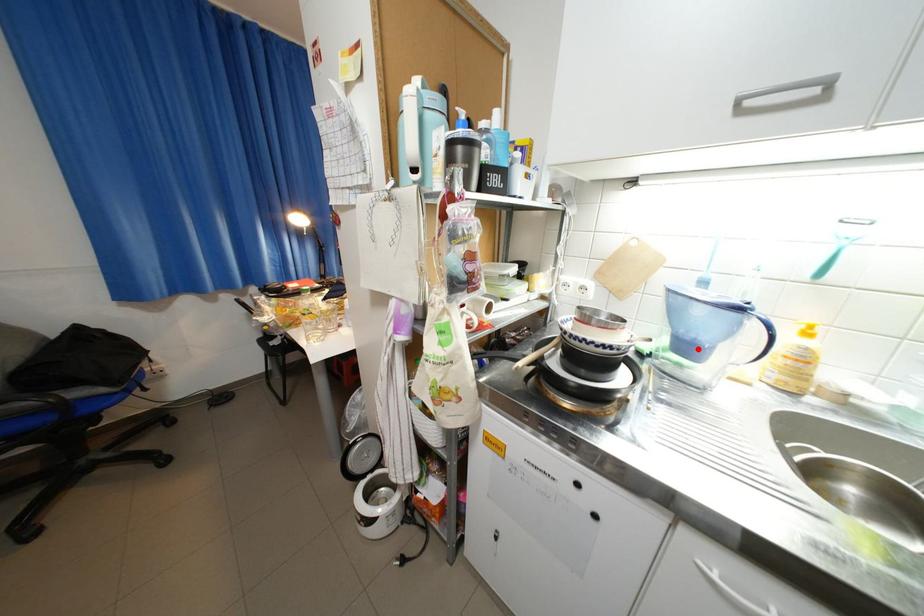
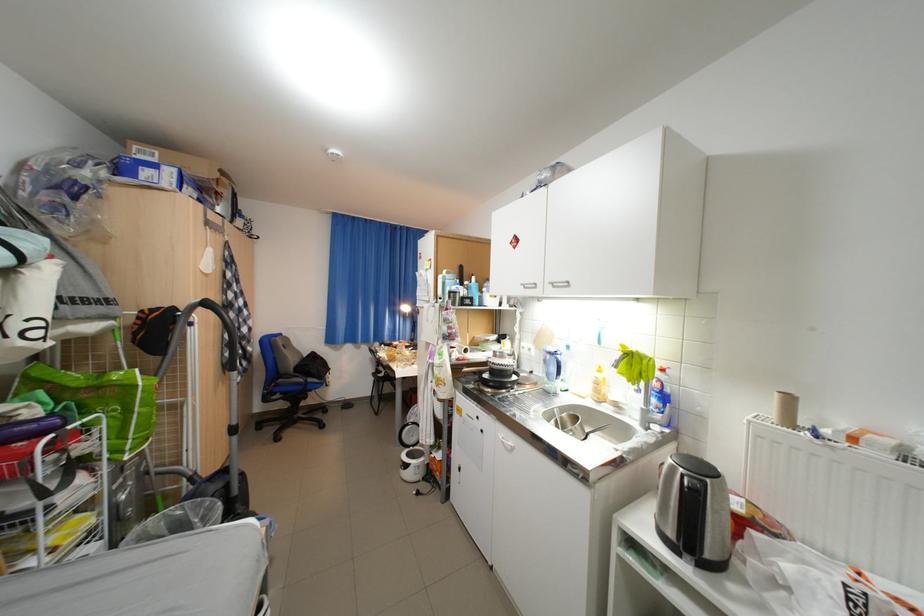
Where in the second image is the point corresponding to the highlighted location from the first image?

(560, 376)